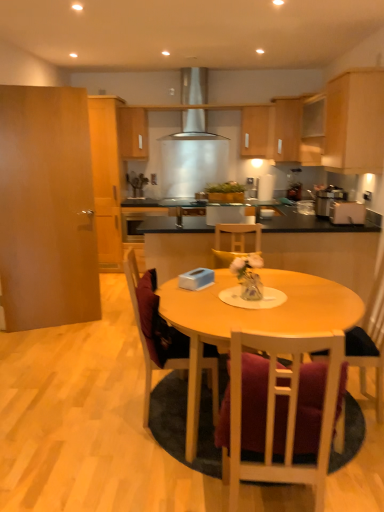
Question: Is light wood cabinet at upper right, the seventh cabinetry positioned from the left, at the back of brown wood door at left, which is counted as the 1th cabinetry, starting from the left?

Choices:
 (A) no
 (B) yes

Answer: (A)

Question: From the image's perspective, is brown wood door at left, placed as the 8th cabinetry when sorted from right to left, beneath light wood cabinet at upper right, the seventh cabinetry positioned from the left?

Choices:
 (A) no
 (B) yes

Answer: (B)

Question: Can light wood cabinet at upper right, the seventh cabinetry positioned from the left, be found inside brown wood door at left, placed as the 8th cabinetry when sorted from right to left?

Choices:
 (A) no
 (B) yes

Answer: (A)

Question: Is brown wood door at left, which is counted as the 1th cabinetry, starting from the left, far away from light wood cabinet at upper right, the seventh cabinetry positioned from the left?

Choices:
 (A) no
 (B) yes

Answer: (B)

Question: Can you confirm if brown wood door at left, which is counted as the 1th cabinetry, starting from the left, is bigger than light wood cabinet at upper right, the seventh cabinetry positioned from the left?

Choices:
 (A) yes
 (B) no

Answer: (B)

Question: Is brown wood door at left, which is counted as the 1th cabinetry, starting from the left, at the right side of light wood cabinet at upper right, the seventh cabinetry positioned from the left?

Choices:
 (A) yes
 (B) no

Answer: (B)

Question: Can you confirm if matte wood cabinet at upper center, placed as the fifth cabinetry when sorted from left to right, is shorter than wooden cabinet at upper center, which ranks as the 3th cabinetry in left-to-right order?

Choices:
 (A) yes
 (B) no

Answer: (B)

Question: Can wooden cabinet at upper center, which ranks as the 3th cabinetry in left-to-right order, be found inside matte wood cabinet at upper center, placed as the fifth cabinetry when sorted from left to right?

Choices:
 (A) no
 (B) yes

Answer: (A)

Question: Is matte wood cabinet at upper center, placed as the fifth cabinetry when sorted from left to right, facing away from wooden cabinet at upper center, the sixth cabinetry from the right?

Choices:
 (A) no
 (B) yes

Answer: (A)

Question: Does matte wood cabinet at upper center, which is counted as the 4th cabinetry, starting from the right, have a larger size compared to wooden cabinet at upper center, the sixth cabinetry from the right?

Choices:
 (A) yes
 (B) no

Answer: (A)

Question: Considering the relative positions of matte wood cabinet at upper center, which is counted as the 4th cabinetry, starting from the right, and wooden cabinet at upper center, the sixth cabinetry from the right, in the image provided, is matte wood cabinet at upper center, which is counted as the 4th cabinetry, starting from the right, to the left of wooden cabinet at upper center, the sixth cabinetry from the right, from the viewer's perspective?

Choices:
 (A) yes
 (B) no

Answer: (B)

Question: Is matte wood cabinet at upper center, which is counted as the 4th cabinetry, starting from the right, at the right side of wooden cabinet at upper center, which ranks as the 3th cabinetry in left-to-right order?

Choices:
 (A) no
 (B) yes

Answer: (B)

Question: Considering the relative sizes of wooden cabinet at upper center, which ranks as the 3th cabinetry in left-to-right order, and wooden cabinet at upper center, the fifth cabinetry when ordered from right to left, in the image provided, is wooden cabinet at upper center, which ranks as the 3th cabinetry in left-to-right order, thinner than wooden cabinet at upper center, the fifth cabinetry when ordered from right to left,?

Choices:
 (A) yes
 (B) no

Answer: (B)